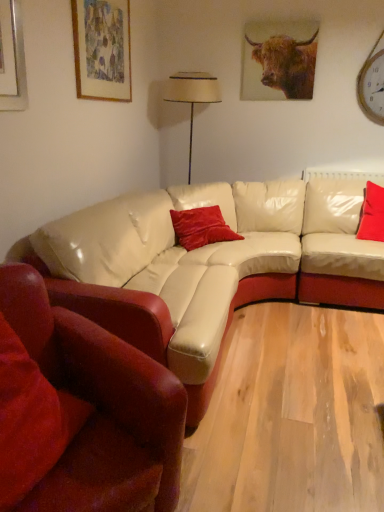
The width and height of the screenshot is (384, 512). What are the coordinates of `velvet red pillow at lower left, the first pillow when ordered from front to back` in the screenshot? It's located at (27, 421).

Describe the element at coordinates (201, 227) in the screenshot. I see `velvet red pillow at center, which is counted as the 2th pillow, starting from the front` at that location.

Describe the element at coordinates (372, 214) in the screenshot. I see `velvet red pillow at right, arranged as the third pillow when viewed from the left` at that location.

The height and width of the screenshot is (512, 384). What are the coordinates of `brown textured bull at upper center` in the screenshot? It's located at (284, 64).

Image resolution: width=384 pixels, height=512 pixels. I want to click on velvet red pillow at lower left, the 3th pillow from the top, so click(27, 421).

Which object is positioned more to the right, beige fabric lampshade at center or velvet red pillow at right, the third pillow when ordered from front to back?

From the viewer's perspective, velvet red pillow at right, the third pillow when ordered from front to back, appears more on the right side.

Consider the image. Is beige fabric lampshade at center wider or thinner than velvet red pillow at right, arranged as the third pillow when viewed from the left?

Considering their sizes, beige fabric lampshade at center looks slimmer than velvet red pillow at right, arranged as the third pillow when viewed from the left.

From a real-world perspective, starting from the beige fabric lampshade at center, which pillow is the 1st one below it? Please provide its 2D coordinates.

[(372, 214)]

From a real-world perspective, is beige fabric lampshade at center physically located above or below velvet red pillow at right, placed as the first pillow when sorted from top to bottom?

In terms of real-world spatial position, beige fabric lampshade at center is above velvet red pillow at right, placed as the first pillow when sorted from top to bottom.

Is suede-like beige couch at lower left positioned far away from velvet red pillow at lower left, the 3th pillow from the top?

Actually, suede-like beige couch at lower left and velvet red pillow at lower left, the 3th pillow from the top, are a little close together.

Is suede-like beige couch at lower left thinner than velvet red pillow at lower left, the 3th pillow from the top?

No.

Locate an element on the screen. The image size is (384, 512). the 2nd pillow located above the suede-like beige couch at lower left (from a real-world perspective) is located at coordinates (27, 421).

Is velvet red pillow at center, the second pillow in the back-to-front sequence, oriented towards brown textured bull at upper center?

No, velvet red pillow at center, the second pillow in the back-to-front sequence, is not facing towards brown textured bull at upper center.

From the image's perspective, relative to brown textured bull at upper center, is velvet red pillow at center, which is the 2th pillow in bottom-to-top order, above or below?

Based on their image positions, velvet red pillow at center, which is the 2th pillow in bottom-to-top order, is located beneath brown textured bull at upper center.

The image size is (384, 512). Find the location of `the 2nd pillow in front of the brown textured bull at upper center`. the 2nd pillow in front of the brown textured bull at upper center is located at coordinates (201, 227).

Looking at their sizes, would you say velvet red pillow at center, which is the second pillow in left-to-right order, is wider or thinner than brown textured bull at upper center?

In the image, velvet red pillow at center, which is the second pillow in left-to-right order, appears to be wider than brown textured bull at upper center.

The height and width of the screenshot is (512, 384). Identify the location of picture frame above the wooden clock at upper right (from a real-world perspective). (102, 49).

Based on their positions, is wooden clock at upper right located to the left or right of matte paper picture frame at upper left?

wooden clock at upper right is to the right of matte paper picture frame at upper left.

Does wooden clock at upper right have a greater width compared to matte paper picture frame at upper left?

Correct, the width of wooden clock at upper right exceeds that of matte paper picture frame at upper left.

Between wooden clock at upper right and matte paper picture frame at upper left, which one is positioned behind?

wooden clock at upper right is further away from the camera.

Considering the sizes of wooden clock at upper right and velvet red pillow at right, arranged as the first pillow when viewed from the right, in the image, is wooden clock at upper right bigger or smaller than velvet red pillow at right, arranged as the first pillow when viewed from the right,?

In the image, wooden clock at upper right appears to be smaller than velvet red pillow at right, arranged as the first pillow when viewed from the right.

Considering the sizes of wooden clock at upper right and velvet red pillow at right, the third pillow when ordered from front to back, in the image, is wooden clock at upper right wider or thinner than velvet red pillow at right, the third pillow when ordered from front to back,?

Considering their sizes, wooden clock at upper right looks slimmer than velvet red pillow at right, the third pillow when ordered from front to back.

What's the angular difference between wooden clock at upper right and velvet red pillow at right, the first pillow from the back,'s facing directions?

1.06 degrees.

Considering the relative sizes of wooden clock at upper right and velvet red pillow at right, the third pillow when ordered from front to back, in the image provided, is wooden clock at upper right taller than velvet red pillow at right, the third pillow when ordered from front to back,?

Indeed, wooden clock at upper right has a greater height compared to velvet red pillow at right, the third pillow when ordered from front to back.

Which is closer to the camera, (261, 82) or (366, 200)?

Point (261, 82).

Can you confirm if brown textured bull at upper center is taller than velvet red pillow at right, placed as the first pillow when sorted from top to bottom?

Yes.

Based on their positions, is brown textured bull at upper center located to the left or right of velvet red pillow at right, placed as the first pillow when sorted from top to bottom?

brown textured bull at upper center is to the left of velvet red pillow at right, placed as the first pillow when sorted from top to bottom.

From the image's perspective, does wooden clock at upper right appear lower than velvet red pillow at center, which is counted as the 2th pillow, starting from the front?

No, from the image's perspective, wooden clock at upper right is not below velvet red pillow at center, which is counted as the 2th pillow, starting from the front.

Is wooden clock at upper right next to velvet red pillow at center, which is counted as the 2th pillow, starting from the front?

wooden clock at upper right and velvet red pillow at center, which is counted as the 2th pillow, starting from the front, are clearly separated.

Considering the sizes of wooden clock at upper right and velvet red pillow at center, which is counted as the 2th pillow, starting from the top, in the image, is wooden clock at upper right wider or thinner than velvet red pillow at center, which is counted as the 2th pillow, starting from the top,?

wooden clock at upper right is thinner than velvet red pillow at center, which is counted as the 2th pillow, starting from the top.

From a real-world perspective, is wooden clock at upper right physically below velvet red pillow at center, the second pillow in the back-to-front sequence?

Actually, wooden clock at upper right is physically above velvet red pillow at center, the second pillow in the back-to-front sequence, in the real world.

Locate an element on the screen. This screenshot has height=512, width=384. the 2nd pillow to the right of the beige fabric lampshade at center, counting from the anchor's position is located at coordinates (372, 214).

Where is `pillow on the left of suede-like beige couch at lower left`? pillow on the left of suede-like beige couch at lower left is located at coordinates (27, 421).

Based on their spatial positions, is brown textured bull at upper center or beige fabric lampshade at center further from suede-like beige couch at lower left?

The object further to suede-like beige couch at lower left is brown textured bull at upper center.

When comparing their distances from velvet red pillow at center, which is counted as the 2th pillow, starting from the front, does brown textured bull at upper center or wooden clock at upper right seem further?

Based on the image, wooden clock at upper right appears to be further to velvet red pillow at center, which is counted as the 2th pillow, starting from the front.

Estimate the real-world distances between objects in this image. Which object is further from velvet red pillow at lower left, the 3th pillow from the top, velvet red pillow at center, which is counted as the 2th pillow, starting from the front, or brown textured bull at upper center?

brown textured bull at upper center is further to velvet red pillow at lower left, the 3th pillow from the top.

Considering their positions, is velvet red pillow at right, arranged as the third pillow when viewed from the left, positioned closer to beige fabric lampshade at center than velvet red pillow at center, which is counted as the 2th pillow, starting from the front?

velvet red pillow at center, which is counted as the 2th pillow, starting from the front, is positioned closer to the anchor beige fabric lampshade at center.

Considering their positions, is velvet red pillow at center, which is counted as the 2th pillow, starting from the top, positioned closer to beige fabric lampshade at center than brown textured bull at upper center?

brown textured bull at upper center is positioned closer to the anchor beige fabric lampshade at center.

From the image, which object appears to be nearer to velvet red pillow at lower left, which appears as the 1th pillow when viewed from the left, beige fabric lampshade at center or matte paper picture frame at upper left?

matte paper picture frame at upper left is closer to velvet red pillow at lower left, which appears as the 1th pillow when viewed from the left.

Which object lies further to the anchor point velvet red pillow at right, arranged as the third pillow when viewed from the left, matte paper picture frame at upper left or wooden clock at upper right?

matte paper picture frame at upper left lies further to velvet red pillow at right, arranged as the third pillow when viewed from the left, than the other object.

Consider the image. When comparing their distances from brown textured bull at upper center, does velvet red pillow at right, arranged as the first pillow when viewed from the right, or matte paper picture frame at upper left seem closer?

The object closer to brown textured bull at upper center is velvet red pillow at right, arranged as the first pillow when viewed from the right.

This screenshot has height=512, width=384. In order to click on bull between beige fabric lampshade at center and velvet red pillow at right, placed as the first pillow when sorted from top to bottom, from left to right in this screenshot , I will do `click(284, 64)`.

The image size is (384, 512). Identify the location of pillow situated between matte paper picture frame at upper left and velvet red pillow at right, placed as the first pillow when sorted from top to bottom, from left to right. (201, 227).

At what (x,y) coordinates should I click in order to perform the action: click on bull between beige fabric lampshade at center and wooden clock at upper right. Please return your answer as a coordinate pair (x, y). Looking at the image, I should click on (284, 64).

Find the location of a particular element. Image resolution: width=384 pixels, height=512 pixels. clock that lies between brown textured bull at upper center and velvet red pillow at center, which is counted as the 2th pillow, starting from the front, from top to bottom is located at coordinates (373, 83).